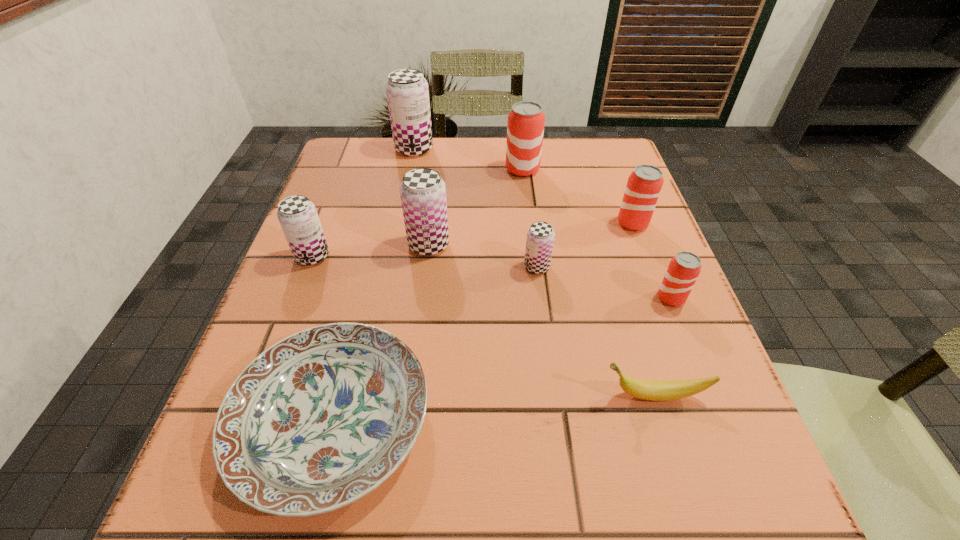
At what (x,y) coordinates should I click in order to perform the action: click on purple beer can that is the second closest to the second farthest beer can. Please return your answer as a coordinate pair (x, y). This screenshot has height=540, width=960. Looking at the image, I should click on (423, 192).

Image resolution: width=960 pixels, height=540 pixels. Identify the location of purple beer can that is the second closest to the rightmost purple beer can. (298, 217).

I want to click on orange beer can that is the closest to the nearest beer can, so click(x=644, y=185).

Where is `orange beer can that is the second closest to the second biggest orange beer can`? The width and height of the screenshot is (960, 540). orange beer can that is the second closest to the second biggest orange beer can is located at coordinates (525, 127).